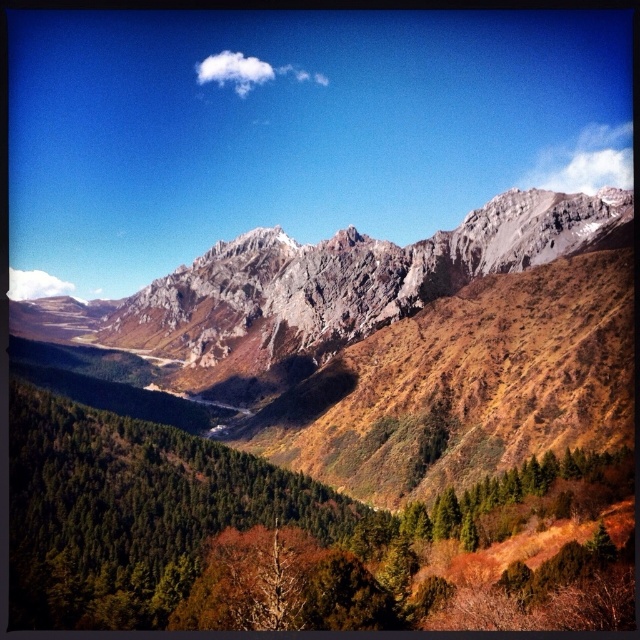
Who is positioned more to the right, rocky gray mountains at upper center or rocky gray mountain range at center?

From the viewer's perspective, rocky gray mountains at upper center appears more on the right side.

How much distance is there between rocky gray mountains at upper center and rocky gray mountain range at center?

The distance of rocky gray mountains at upper center from rocky gray mountain range at center is 25.02 meters.

Does point (125, 428) come farther from viewer compared to point (328, 304)?

No, (125, 428) is closer to viewer.

The image size is (640, 640). Find the location of `rocky gray mountains at upper center`. rocky gray mountains at upper center is located at coordinates (321, 420).